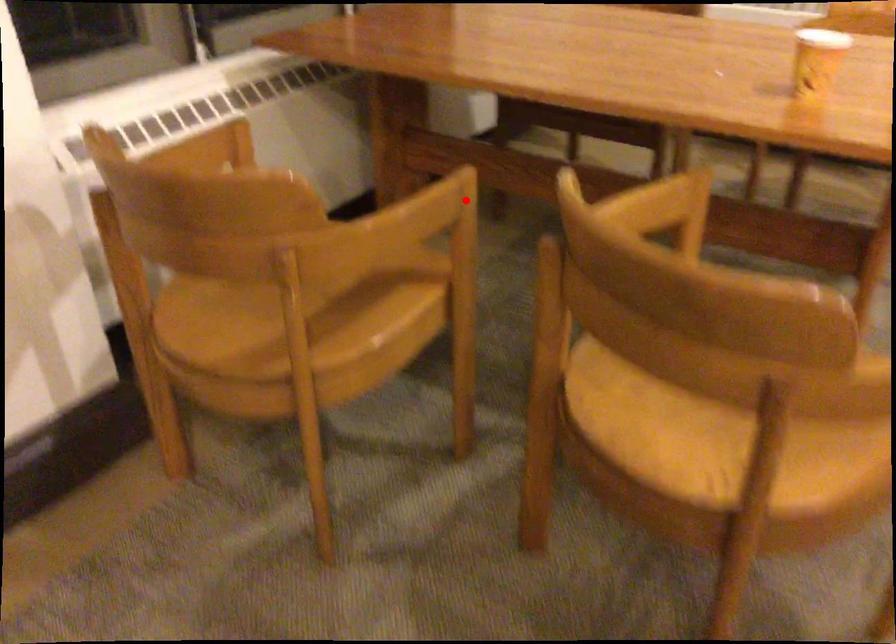
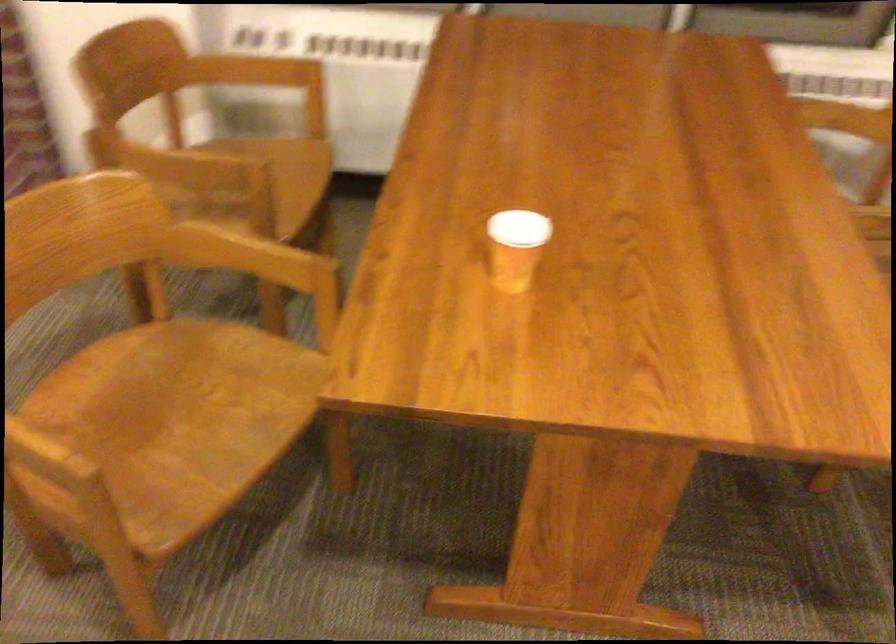
Question: A red point is marked in image1. In image2, is the corresponding 3D point closer to the camera or farther? Reply with the corresponding letter.

Choices:
 (A) The corresponding 3D point is closer.
 (B) The corresponding 3D point is farther.

Answer: (B)